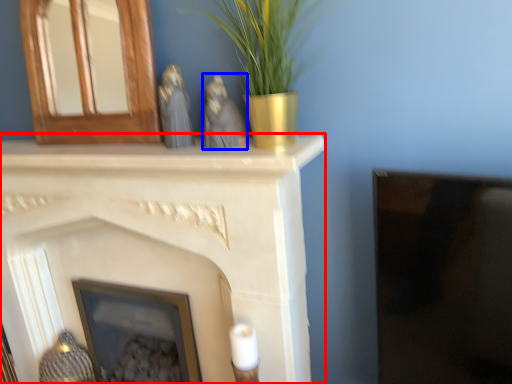
Question: Which point is closer to the camera, fireplace (highlighted by a red box) or animal (highlighted by a blue box)?

Choices:
 (A) fireplace
 (B) animal

Answer: (B)